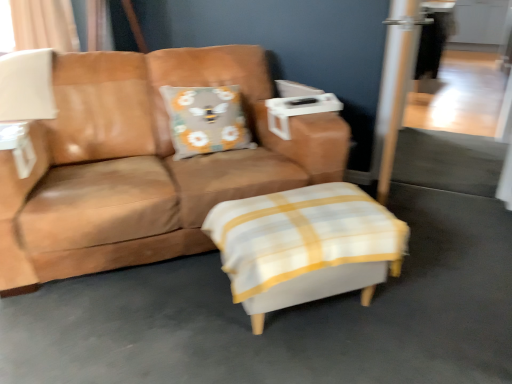
Question: Does white fabric ottoman at center have a greater height compared to gray fabric pillow with bee design at center?

Choices:
 (A) yes
 (B) no

Answer: (B)

Question: Does white fabric ottoman at center lie in front of gray fabric pillow with bee design at center?

Choices:
 (A) yes
 (B) no

Answer: (A)

Question: Would you say white fabric ottoman at center is outside gray fabric pillow with bee design at center?

Choices:
 (A) no
 (B) yes

Answer: (B)

Question: From the image's perspective, does white fabric ottoman at center appear lower than gray fabric pillow with bee design at center?

Choices:
 (A) yes
 (B) no

Answer: (A)

Question: Considering the relative sizes of white fabric ottoman at center and gray fabric pillow with bee design at center in the image provided, is white fabric ottoman at center thinner than gray fabric pillow with bee design at center?

Choices:
 (A) yes
 (B) no

Answer: (B)

Question: Considering the relative positions of brown leather couch at center and beige fabric curtain at upper left in the image provided, is brown leather couch at center to the left or to the right of beige fabric curtain at upper left?

Choices:
 (A) right
 (B) left

Answer: (A)

Question: Looking at their shapes, would you say brown leather couch at center is wider or thinner than beige fabric curtain at upper left?

Choices:
 (A) wide
 (B) thin

Answer: (A)

Question: Is brown leather couch at center spatially inside beige fabric curtain at upper left, or outside of it?

Choices:
 (A) inside
 (B) outside

Answer: (B)

Question: Based on their sizes in the image, would you say brown leather couch at center is bigger or smaller than beige fabric curtain at upper left?

Choices:
 (A) big
 (B) small

Answer: (A)

Question: Would you say white fabric ottoman at center is inside or outside gray fabric pillow with bee design at center?

Choices:
 (A) inside
 (B) outside

Answer: (B)

Question: From a real-world perspective, is white fabric ottoman at center above or below gray fabric pillow with bee design at center?

Choices:
 (A) above
 (B) below

Answer: (B)

Question: Considering their positions, is white fabric ottoman at center located in front of or behind gray fabric pillow with bee design at center?

Choices:
 (A) front
 (B) behind

Answer: (A)

Question: Is white fabric ottoman at center wider or thinner than gray fabric pillow with bee design at center?

Choices:
 (A) wide
 (B) thin

Answer: (A)

Question: Considering the positions of point (40, 51) and point (38, 236), is point (40, 51) closer or farther from the camera than point (38, 236)?

Choices:
 (A) closer
 (B) farther

Answer: (B)

Question: Is white matte table lamp at upper left in front of or behind brown leather couch at center in the image?

Choices:
 (A) behind
 (B) front

Answer: (A)